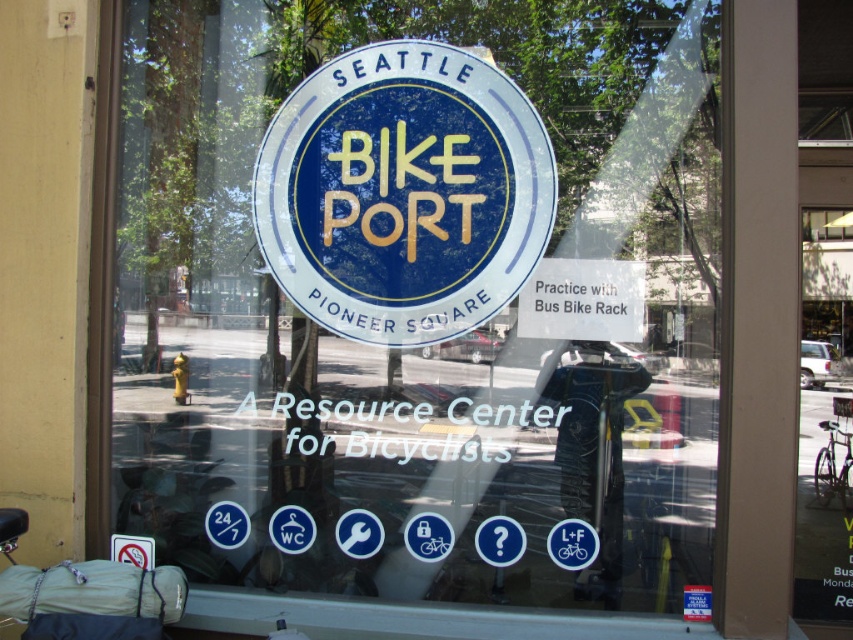
How far apart are blue matte sign at center and white paper sign at center?

blue matte sign at center is 13.65 inches from white paper sign at center.

Which is above, blue matte sign at center or white paper sign at center?

blue matte sign at center is above.

The height and width of the screenshot is (640, 853). Describe the element at coordinates (403, 193) in the screenshot. I see `blue matte sign at center` at that location.

The height and width of the screenshot is (640, 853). I want to click on blue matte sign at center, so click(x=403, y=193).